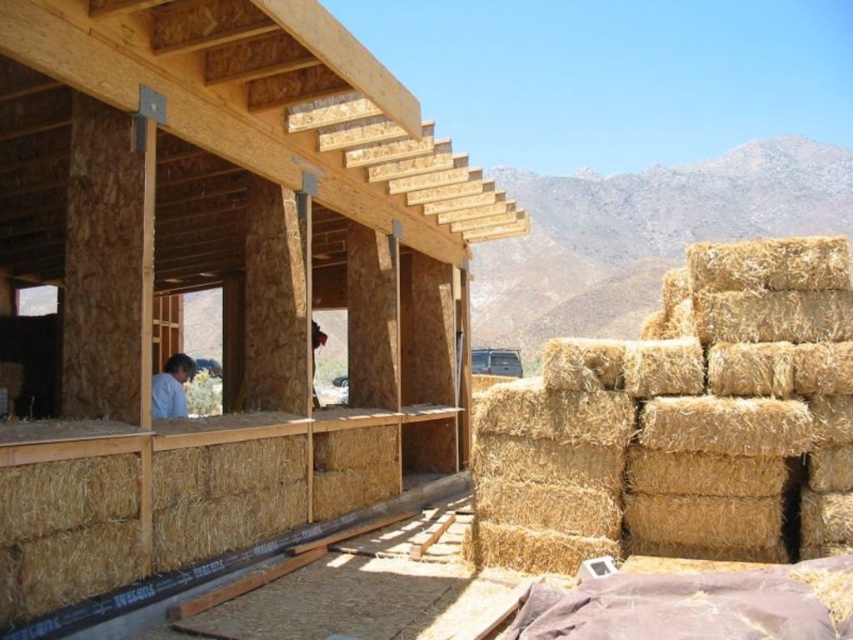
Does point (688, 269) come closer to viewer compared to point (160, 404)?

Yes, it is in front of point (160, 404).

Does yellow straw bales at right lie behind light blue shirt at lower left?

Yes.

Locate an element on the screen. This screenshot has width=853, height=640. yellow straw bales at right is located at coordinates (683, 422).

You are a GUI agent. You are given a task and a screenshot of the screen. Output one action in this format:
    pyautogui.click(x=<x>, y=<y>)
    Task: Click on the yellow straw bales at right
    The height and width of the screenshot is (640, 853).
    Given the screenshot: What is the action you would take?
    pyautogui.click(x=683, y=422)

Can you confirm if natural straw bales at right is positioned to the right of yellow straw bales at right?

In fact, natural straw bales at right is to the left of yellow straw bales at right.

Who is positioned more to the left, natural straw bales at right or yellow straw bales at right?

Positioned to the left is natural straw bales at right.

The width and height of the screenshot is (853, 640). Describe the element at coordinates (219, 276) in the screenshot. I see `natural straw bales at right` at that location.

You are a GUI agent. You are given a task and a screenshot of the screen. Output one action in this format:
    pyautogui.click(x=<x>, y=<y>)
    Task: Click on the natural straw bales at right
    
    Given the screenshot: What is the action you would take?
    click(219, 276)

Does natural straw bales at right have a lesser height compared to light blue shirt at lower left?

No, natural straw bales at right is not shorter than light blue shirt at lower left.

Does point (42, 100) come in front of point (171, 358)?

Yes.

What are the coordinates of `natural straw bales at right` in the screenshot? It's located at (219, 276).